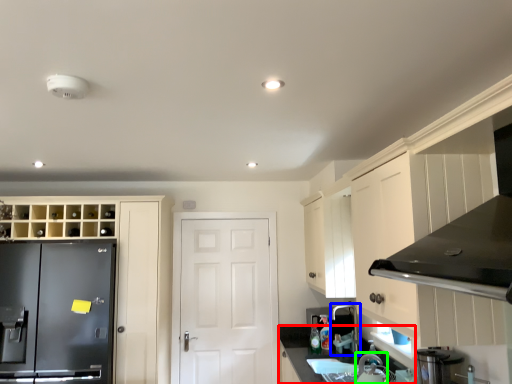
Question: Based on their relative distances, which object is farther from counter top (highlighted by a red box)? Choose from faucet (highlighted by a blue box) and appliance (highlighted by a green box).

Choices:
 (A) faucet
 (B) appliance

Answer: (B)